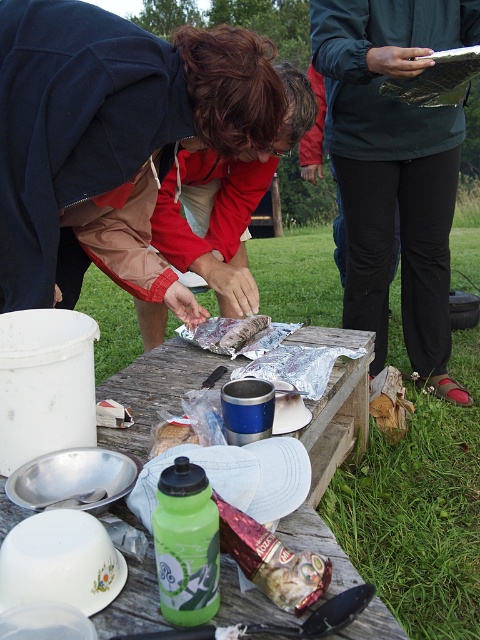
Question: Is the position of green matte jacket at upper center less distant than that of wooden picnic table at center?

Choices:
 (A) no
 (B) yes

Answer: (A)

Question: Which object appears farthest from the camera in this image?

Choices:
 (A) brown crumbly bread at center
 (B) green matte jacket at upper center
 (C) matte red jacket at center
 (D) wooden picnic table at center

Answer: (B)

Question: Estimate the real-world distances between objects in this image. Which object is closer to the brown crumbly bread at center?

Choices:
 (A) brown paper bag at center
 (B) matte red jacket at center
 (C) wooden picnic table at center
 (D) green matte jacket at upper center

Answer: (C)

Question: Which of the following is the farthest from the observer?

Choices:
 (A) (256, 316)
 (B) (356, 333)

Answer: (B)

Question: Does wooden picnic table at center appear over matte red jacket at center?

Choices:
 (A) no
 (B) yes

Answer: (A)

Question: Is wooden picnic table at center below brown paper bag at center?

Choices:
 (A) yes
 (B) no

Answer: (A)